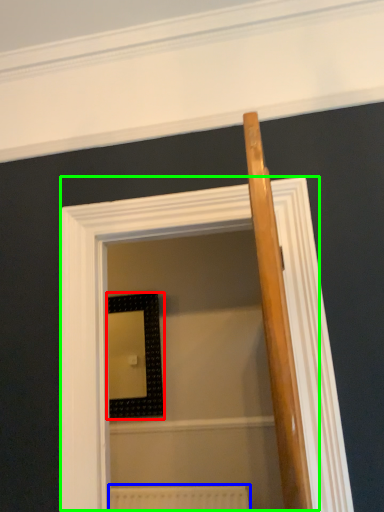
Question: Which object is positioned farthest from picture frame (highlighted by a red box)? Select from radiator (highlighted by a blue box) and screen door (highlighted by a green box).

Choices:
 (A) radiator
 (B) screen door

Answer: (B)